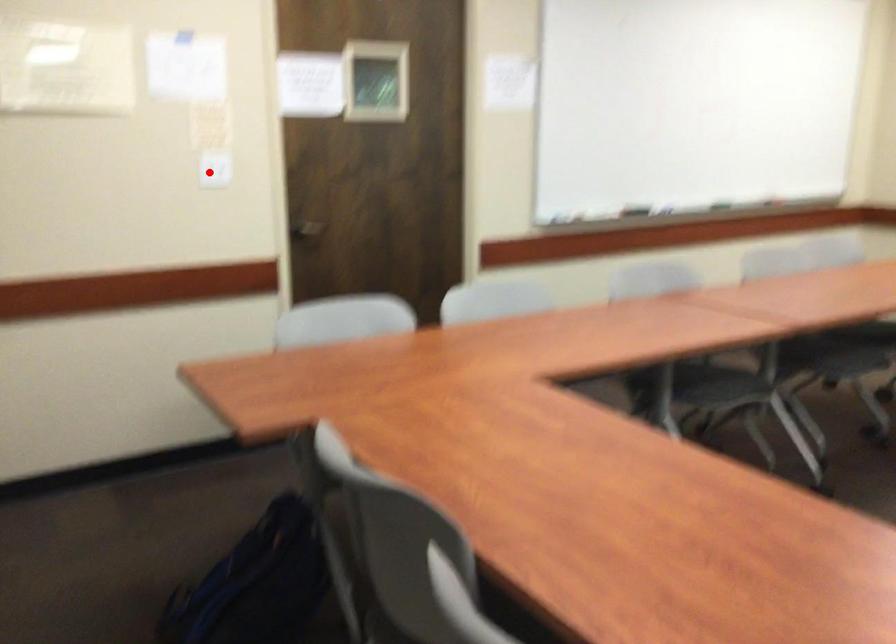
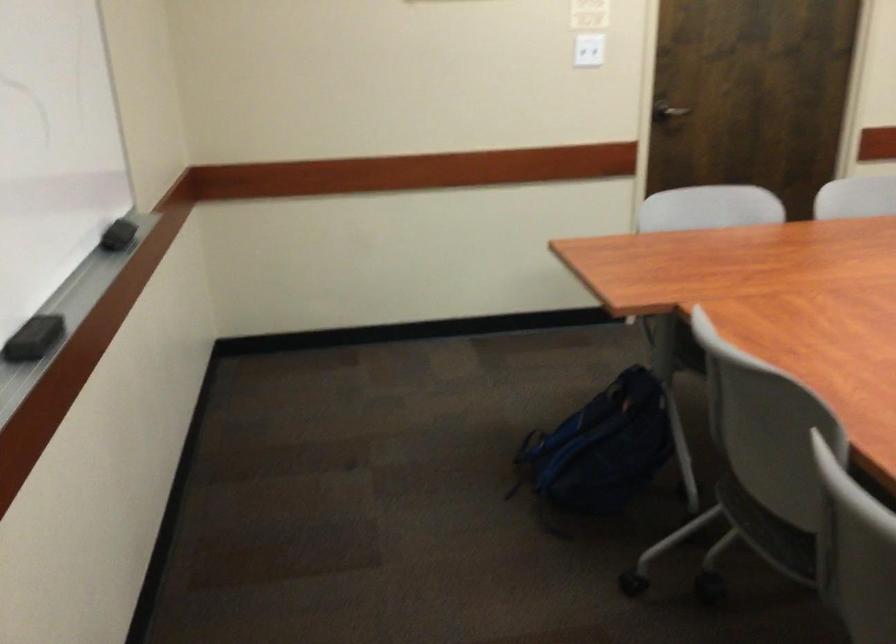
In the second image, find the point that corresponds to the highlighted location in the first image.

(588, 51)